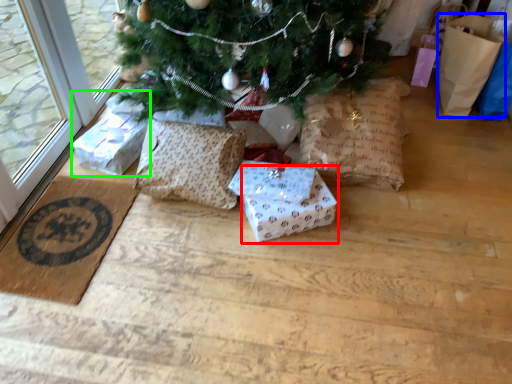
Question: Which object is the farthest from gift box (highlighted by a red box)? Choose among these: gift bag (highlighted by a blue box) or gift box (highlighted by a green box).

Choices:
 (A) gift bag
 (B) gift box

Answer: (A)